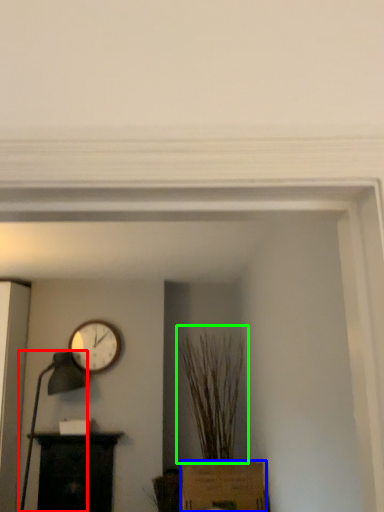
Question: Which object is positioned closest to table lamp (highlighted by a red box)? Select from cardboard box (highlighted by a blue box) and plant (highlighted by a green box).

Choices:
 (A) cardboard box
 (B) plant

Answer: (B)